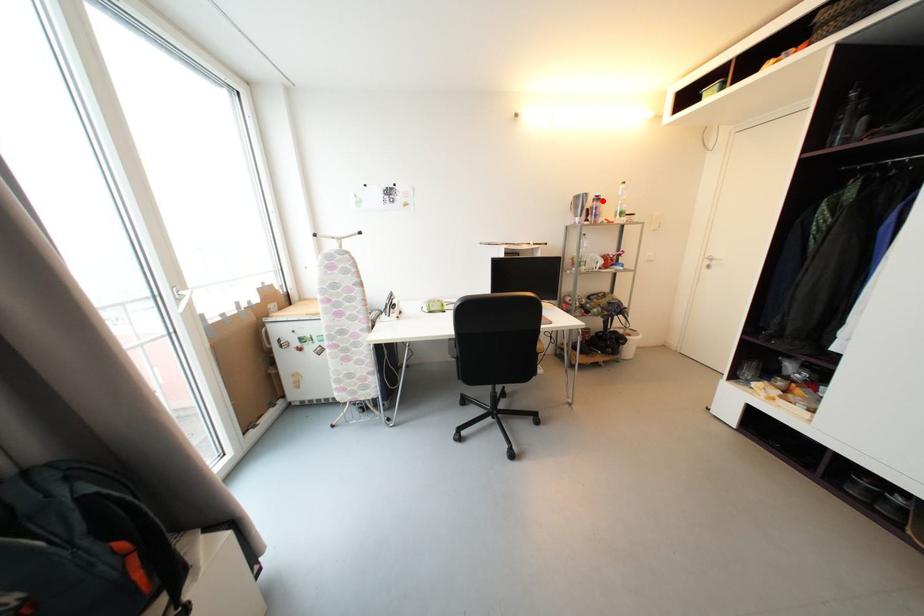
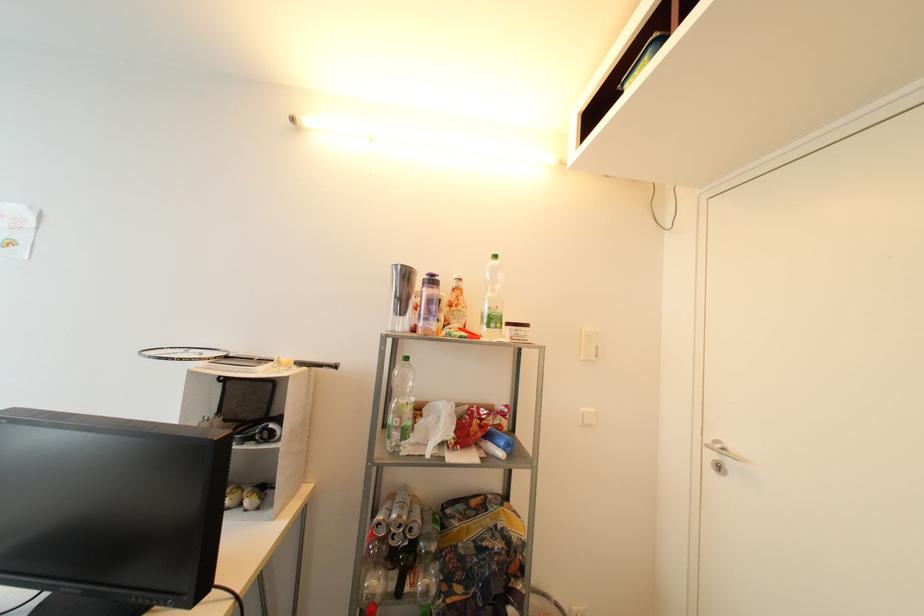
Where in the second image is the point corresponding to the highlighted location from the first image?

(438, 283)